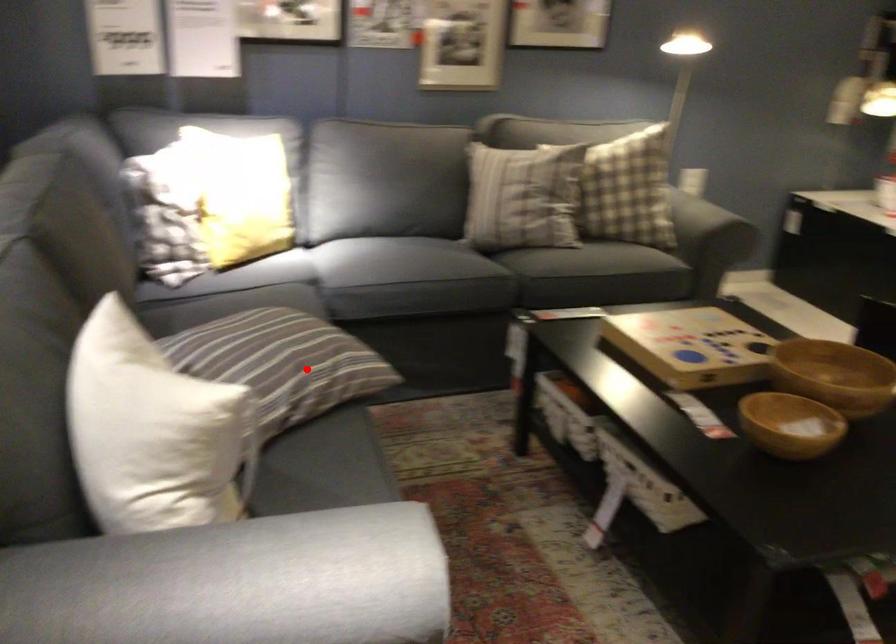
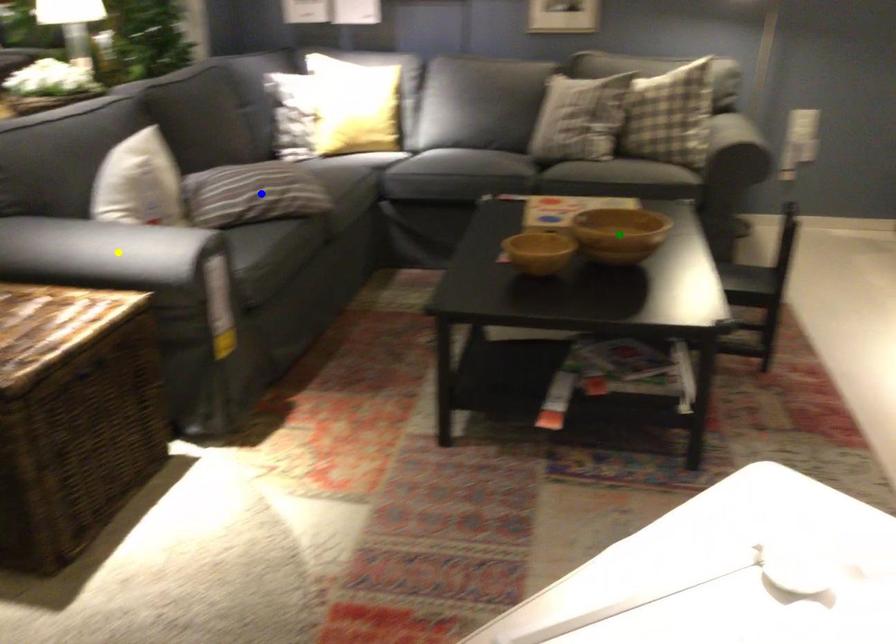
Question: I am providing you with two images of the same scene from different viewpoints. A red point is marked on the first image. You are given multiple points on the second image. Which mark in image 2 goes with the point in image 1?

Choices:
 (A) green point
 (B) blue point
 (C) yellow point

Answer: (B)